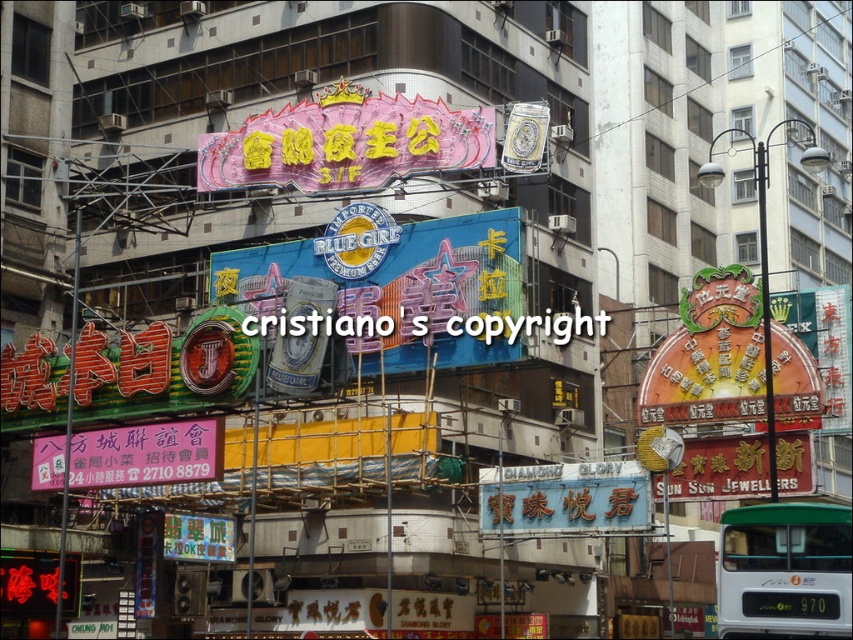
Question: Estimate the real-world distances between objects in this image. Which object is farther from the pink glossy neon sign at upper center?

Choices:
 (A) green matte bus at lower right
 (B) black plastic text at center

Answer: (A)

Question: Estimate the real-world distances between objects in this image. Which object is closer to the pink glossy neon sign at upper center?

Choices:
 (A) green matte bus at lower right
 (B) black plastic text at center

Answer: (B)

Question: Does green matte bus at lower right have a smaller size compared to black plastic text at center?

Choices:
 (A) yes
 (B) no

Answer: (B)

Question: Can you confirm if green matte bus at lower right is positioned to the left of black plastic text at center?

Choices:
 (A) yes
 (B) no

Answer: (B)

Question: Can you confirm if green matte bus at lower right is positioned below black plastic text at center?

Choices:
 (A) no
 (B) yes

Answer: (B)

Question: Which object is positioned closest to the black plastic text at center?

Choices:
 (A) pink glossy neon sign at upper center
 (B) green matte bus at lower right

Answer: (A)